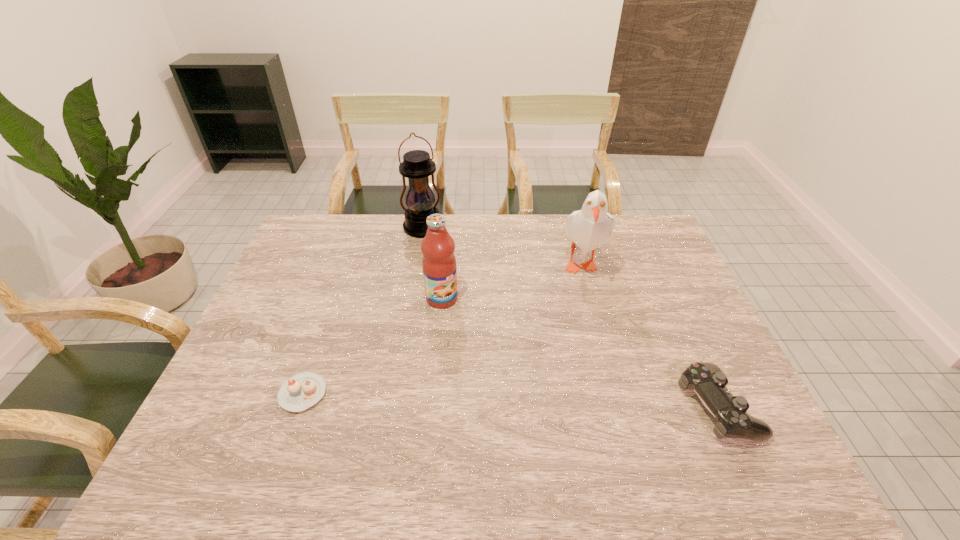
This screenshot has width=960, height=540. In the image, there is a desktop. Identify the location of vacant space at the far left corner. (312, 249).

Identify the location of blank space at the far right corner of the desktop. (625, 217).

You are a GUI agent. You are given a task and a screenshot of the screen. Output one action in this format:
    pyautogui.click(x=<x>, y=<y>)
    Task: Click on the vacant space that is in between the gull and the lantern
    The image size is (960, 540).
    Given the screenshot: What is the action you would take?
    pyautogui.click(x=501, y=244)

At what (x,y) coordinates should I click in order to perform the action: click on free spot between the fruit juice and the cupcake. Please return your answer as a coordinate pair (x, y). The image size is (960, 540). Looking at the image, I should click on (372, 346).

The image size is (960, 540). I want to click on free space between the second object from right to left and the fruit juice, so click(510, 279).

I want to click on vacant area that lies between the rightmost object and the fruit juice, so (580, 353).

This screenshot has width=960, height=540. Identify the location of vacant region between the lantern and the shortest object. (363, 310).

What are the coordinates of `vacant space that is in between the fruit juice and the rightmost object` in the screenshot? It's located at (580, 353).

You are a GUI agent. You are given a task and a screenshot of the screen. Output one action in this format:
    pyautogui.click(x=<x>, y=<y>)
    Task: Click on the blank region between the gull and the leftmost object
    This screenshot has width=960, height=540.
    Given the screenshot: What is the action you would take?
    pyautogui.click(x=441, y=327)

What are the coordinates of `vacant area that lies between the fruit juice and the shortest object` in the screenshot? It's located at (372, 346).